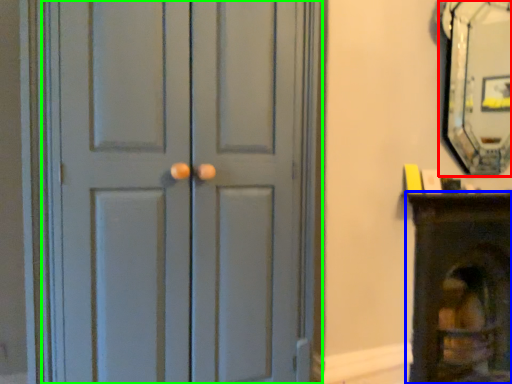
Question: Which object is positioned closest to fireplace (highlighted by a red box)? Select from furniture (highlighted by a blue box) and door (highlighted by a green box).

Choices:
 (A) furniture
 (B) door

Answer: (A)